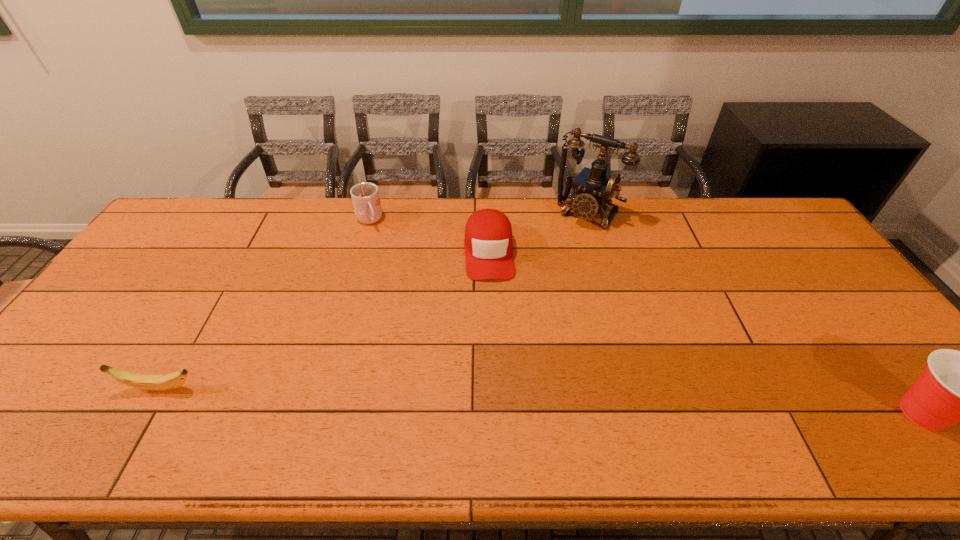
This screenshot has width=960, height=540. I want to click on the leftmost object, so click(x=163, y=382).

This screenshot has width=960, height=540. I want to click on the shortest object, so click(x=163, y=382).

The image size is (960, 540). Find the location of `baseball cap`. baseball cap is located at coordinates (488, 244).

What are the coordinates of `the second shortest object` in the screenshot? It's located at (488, 244).

The height and width of the screenshot is (540, 960). Identify the location of the second object from right to left. (594, 187).

I want to click on the tallest object, so click(x=594, y=187).

Where is `the farther cup`? This screenshot has height=540, width=960. the farther cup is located at coordinates (365, 196).

Image resolution: width=960 pixels, height=540 pixels. I want to click on the fourth object from right to left, so click(x=365, y=196).

At what (x,y) coordinates should I click in order to perform the action: click on vacant space situated at the stem of the shortest object. Please return your answer as a coordinate pair (x, y). This screenshot has height=540, width=960. Looking at the image, I should click on (37, 388).

The width and height of the screenshot is (960, 540). In order to click on free spot located at the stem of the shortest object in this screenshot , I will do pyautogui.click(x=34, y=388).